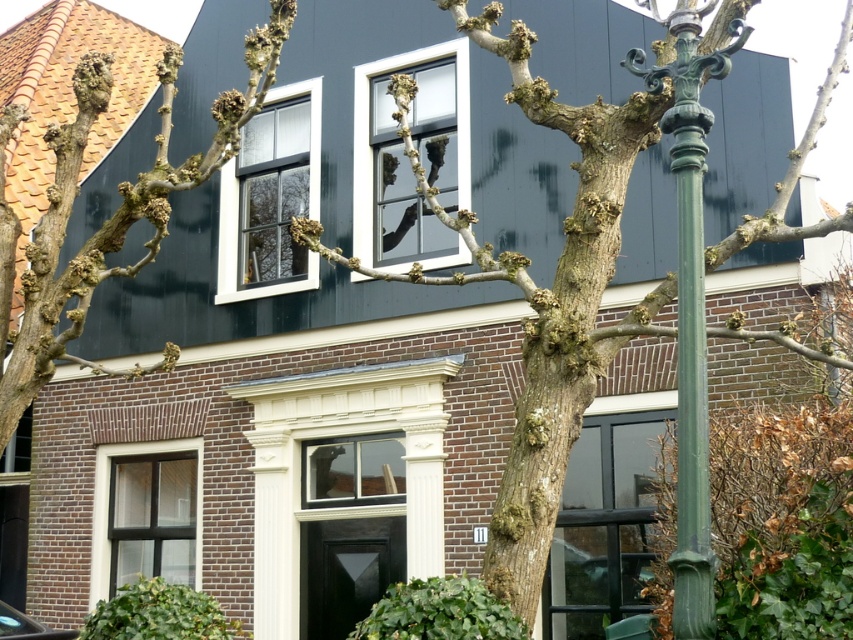
Which is below, bark textured tree at center or green polished metal pole at right?

green polished metal pole at right

Does bark textured tree at center have a lesser height compared to green polished metal pole at right?

Indeed, bark textured tree at center has a lesser height compared to green polished metal pole at right.

Does point (706, 490) come farther from viewer compared to point (699, 116)?

No, (706, 490) is in front of (699, 116).

Where is `bark textured tree at center`? The width and height of the screenshot is (853, 640). bark textured tree at center is located at coordinates (605, 282).

Is bare branches at upper left above green polished metal pole at right?

Yes, bare branches at upper left is above green polished metal pole at right.

Looking at this image, between bare branches at upper left and green polished metal pole at right, which one has more height?

Standing taller between the two is green polished metal pole at right.

Find the location of a particular element. bare branches at upper left is located at coordinates (109, 216).

Who is positioned more to the left, bark textured tree at center or bare branches at upper left?

bare branches at upper left is more to the left.

Does point (805, 152) lie behind point (241, 104)?

No, it is not.

This screenshot has height=640, width=853. I want to click on bark textured tree at center, so click(605, 282).